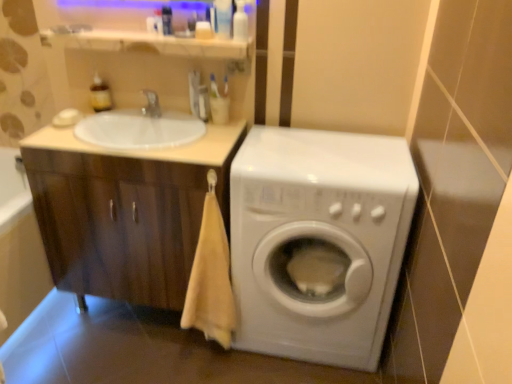
Where is `vacant space to the right of white matte soap at upper left, the first soap when ordered from top to bottom`? vacant space to the right of white matte soap at upper left, the first soap when ordered from top to bottom is located at coordinates (119, 117).